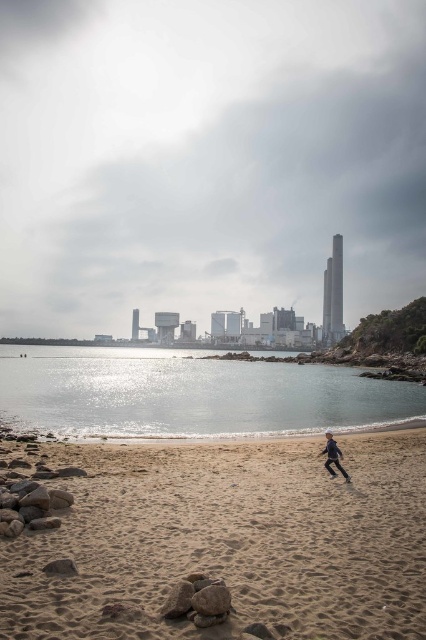
You are standing on the beach and see two points marked on the sand. The first point is at coordinates point (377, 634) and the second is at point (342, 467). Which point is closer to you?

Point (377, 634) is in front of point (342, 467), so it is closer to you.

You are a drone operator trying to capture aerial footage of the sandy beach at lower center and the clear water at center. If you want to ensure both areas are visible in the same shot, which object should you position closer to the bottom of the frame?

The sandy beach at lower center should be positioned closer to the bottom of the frame because it is shorter in height compared to the clear water at center.

You are standing on the beach and want to reach a specific point marked at coordinates point (9,632). If you need to walk exactly 9 meters to reach it, will you arrive at the correct location?

Yes, because the distance of point (9,632) from the viewer is exactly 9.00 meters, so walking that distance will bring you to the correct location.